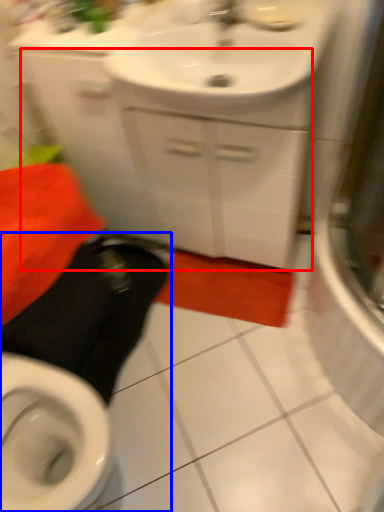
Question: Among these objects, which one is nearest to the camera, cabinetry (highlighted by a red box) or squat (highlighted by a blue box)?

Choices:
 (A) cabinetry
 (B) squat

Answer: (B)